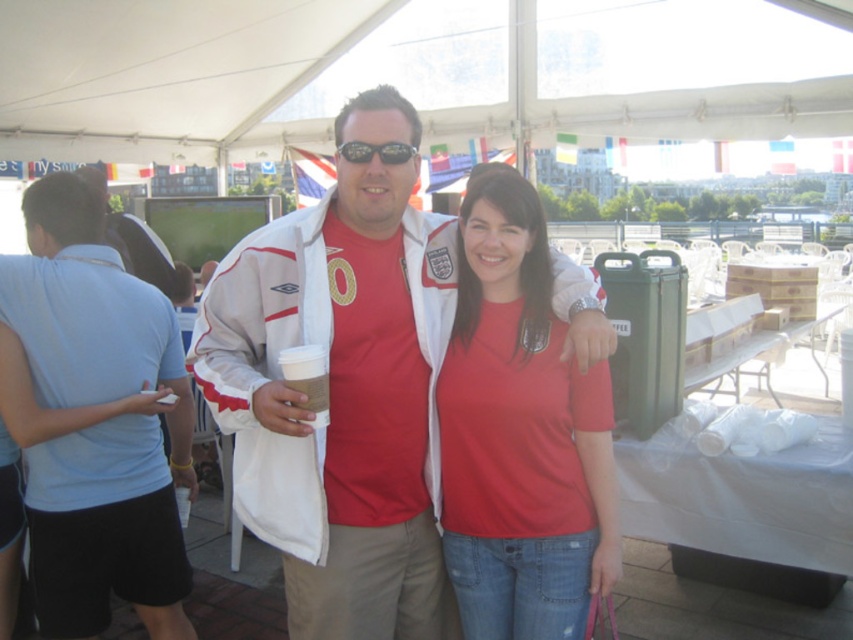
Question: Does matte white jacket at center lie in front of black plastic goggles at center?

Choices:
 (A) yes
 (B) no

Answer: (B)

Question: Is white matte jacket at center in front of matte red t-shirt at center?

Choices:
 (A) yes
 (B) no

Answer: (A)

Question: Can you confirm if matte red t-shirt at center is positioned below black plastic goggles at center?

Choices:
 (A) yes
 (B) no

Answer: (A)

Question: Considering the real-world distances, which object is farthest from the black plastic goggles at center?

Choices:
 (A) matte red t-shirt at center
 (B) matte white jacket at center
 (C) white matte jacket at center

Answer: (B)

Question: Which point is farther from the camera taking this photo?

Choices:
 (A) (482, 476)
 (B) (170, 314)

Answer: (B)

Question: Considering the real-world distances, which object is farthest from the matte red t-shirt at center?

Choices:
 (A) matte white jacket at center
 (B) black plastic goggles at center
 (C) white matte jacket at center

Answer: (A)